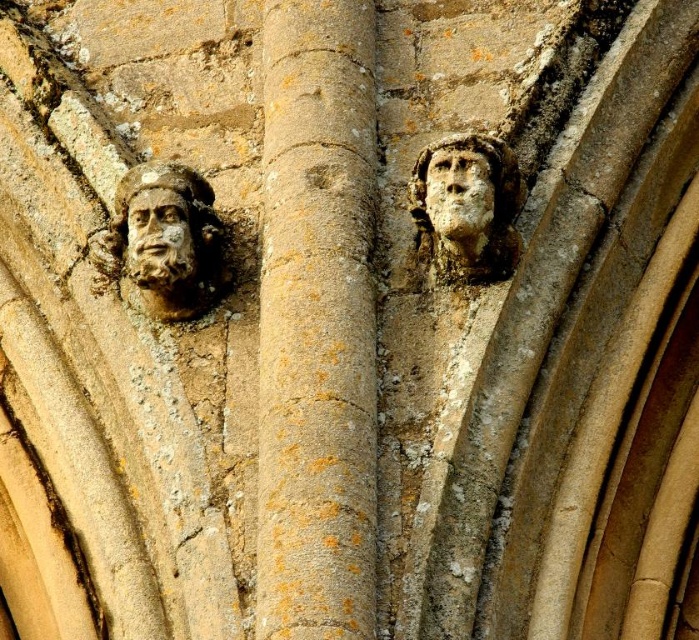
You are an architect examining the ancient stone structure. You need to determine which object has a greater width between the brown stone column at center and the carved stone face at upper right. Based on the scene, which one is wider?

The brown stone column at center is wider than the carved stone face at upper right according to the description.